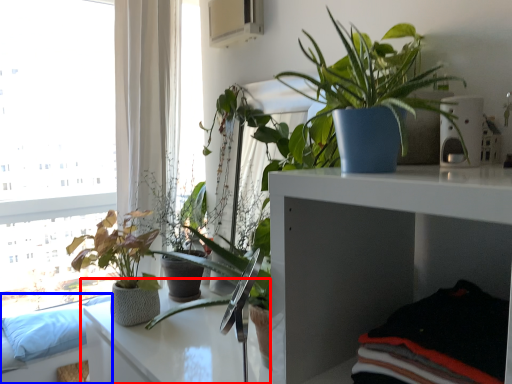
Question: Which of the following is the closest to the observer, table (highlighted by a red box) or couch (highlighted by a blue box)?

Choices:
 (A) table
 (B) couch

Answer: (A)